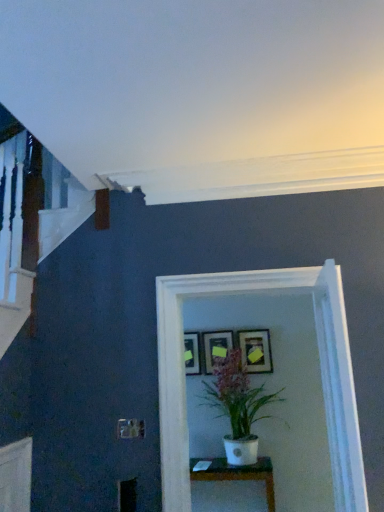
Question: Is matte black picture frame at center, placed as the 3th picture frame when sorted from right to left, inside or outside of matte gold picture frame at center, which is the 3th picture frame from left to right?

Choices:
 (A) outside
 (B) inside

Answer: (A)

Question: From their relative heights in the image, would you say matte black picture frame at center, placed as the 3th picture frame when sorted from right to left, is taller or shorter than matte gold picture frame at center, which is counted as the first picture frame, starting from the right?

Choices:
 (A) tall
 (B) short

Answer: (B)

Question: Which object is positioned closest to the matte black picture frame at center, the 1th picture frame viewed from the left?

Choices:
 (A) white glossy glass door at center
 (B) matte gold picture frame at center, which is counted as the first picture frame, starting from the right
 (C) white glossy table at center
 (D) white matte pot at center
 (E) matte black picture frame at center, which is counted as the second picture frame, starting from the right

Answer: (E)

Question: Considering the real-world distances, which object is farthest from the matte gold picture frame at center, which is counted as the first picture frame, starting from the right?

Choices:
 (A) matte black picture frame at center, placed as the 3th picture frame when sorted from right to left
 (B) white matte pot at center
 (C) white glossy table at center
 (D) matte black picture frame at center, which is counted as the second picture frame, starting from the right
 (E) white glossy glass door at center

Answer: (E)